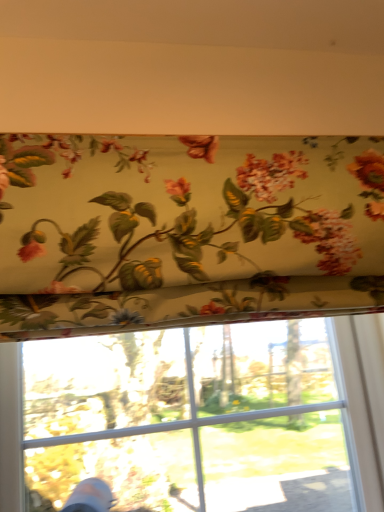
Locate an element on the screen. The image size is (384, 512). floral fabric at upper center is located at coordinates (186, 209).

Describe the element at coordinates (186, 209) in the screenshot. This screenshot has width=384, height=512. I see `floral fabric at upper center` at that location.

The height and width of the screenshot is (512, 384). What do you see at coordinates (210, 417) in the screenshot? I see `floral fabric at upper center` at bounding box center [210, 417].

Locate an element on the screen. This screenshot has height=512, width=384. floral fabric at upper center is located at coordinates (210, 417).

In order to click on floral fabric at upper center in this screenshot , I will do `click(186, 209)`.

Which is more to the right, floral fabric at upper center or floral fabric at upper center?

From the viewer's perspective, floral fabric at upper center appears more on the right side.

Which object is closer to the camera taking this photo, floral fabric at upper center or floral fabric at upper center?

floral fabric at upper center is closer to the camera.

Between point (335, 377) and point (31, 183), which one is positioned in front?

The point (31, 183) is closer to the camera.

From the image's perspective, is floral fabric at upper center on top of floral fabric at upper center?

No, from the image's perspective, floral fabric at upper center is not on top of floral fabric at upper center.

From a real-world perspective, which object rests below the other?

floral fabric at upper center is physically lower.

Considering the sizes of objects floral fabric at upper center and floral fabric at upper center in the image provided, who is wider, floral fabric at upper center or floral fabric at upper center?

Wider between the two is floral fabric at upper center.

From the picture: Is floral fabric at upper center taller or shorter than floral fabric at upper center?

In the image, floral fabric at upper center appears to be taller than floral fabric at upper center.

Is floral fabric at upper center bigger than floral fabric at upper center?

Yes, floral fabric at upper center is bigger than floral fabric at upper center.

Is floral fabric at upper center inside the boundaries of floral fabric at upper center, or outside?

floral fabric at upper center is outside floral fabric at upper center.

Can you see floral fabric at upper center touching floral fabric at upper center?

No, floral fabric at upper center is not with floral fabric at upper center.

Does floral fabric at upper center turn towards floral fabric at upper center?

No, floral fabric at upper center is not aimed at floral fabric at upper center.

Can you tell me how much floral fabric at upper center and floral fabric at upper center differ in facing direction?

The angle between the facing direction of floral fabric at upper center and the facing direction of floral fabric at upper center is 1.38 degrees.

Where is `floral arrangement above the floral fabric at upper center (from the image's perspective)`? The image size is (384, 512). floral arrangement above the floral fabric at upper center (from the image's perspective) is located at coordinates (186, 209).

Can you confirm if floral fabric at upper center is positioned to the left of floral fabric at upper center?

No, floral fabric at upper center is not to the left of floral fabric at upper center.

From the picture: Is the depth of floral fabric at upper center less than that of floral fabric at upper center?

Yes, it is.

Is point (71, 203) positioned behind point (131, 480)?

No.

From the image's perspective, which one is positioned higher, floral fabric at upper center or floral fabric at upper center?

floral fabric at upper center, from the image's perspective.

In the scene shown: From a real-world perspective, which is physically above, floral fabric at upper center or floral fabric at upper center?

floral fabric at upper center.

Considering the relative sizes of floral fabric at upper center and floral fabric at upper center in the image provided, is floral fabric at upper center thinner than floral fabric at upper center?

Correct, the width of floral fabric at upper center is less than that of floral fabric at upper center.

Between floral fabric at upper center and floral fabric at upper center, which one has less height?

With less height is floral fabric at upper center.

Considering the relative sizes of floral fabric at upper center and floral fabric at upper center in the image provided, is floral fabric at upper center smaller than floral fabric at upper center?

Yes.

Is floral fabric at upper center positioned beyond the bounds of floral fabric at upper center?

Indeed, floral fabric at upper center is completely outside floral fabric at upper center.

Is floral fabric at upper center directly adjacent to floral fabric at upper center?

No, floral fabric at upper center is not touching floral fabric at upper center.

Is floral fabric at upper center at the back of floral fabric at upper center?

No.

Measure the distance from floral fabric at upper center to floral fabric at upper center.

A distance of 16.82 inches exists between floral fabric at upper center and floral fabric at upper center.

Image resolution: width=384 pixels, height=512 pixels. What are the coordinates of `bay window behind the floral fabric at upper center` in the screenshot? It's located at (210, 417).

This screenshot has width=384, height=512. What are the coordinates of `floral arrangement in front of the floral fabric at upper center` in the screenshot? It's located at (186, 209).

You are a GUI agent. You are given a task and a screenshot of the screen. Output one action in this format:
    pyautogui.click(x=<x>, y=<y>)
    Task: Click on the floral arrangement on the right of floral fabric at upper center
    
    Given the screenshot: What is the action you would take?
    pyautogui.click(x=186, y=209)